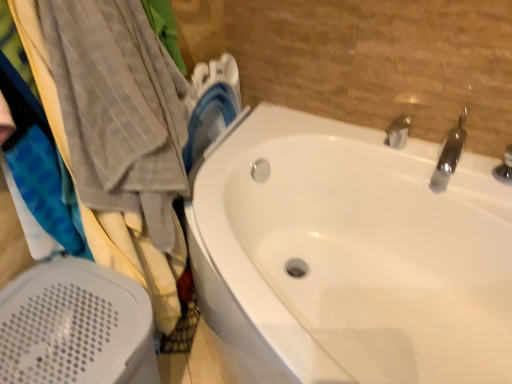
Find the location of a particular element. The width and height of the screenshot is (512, 384). free space above white plastic bath heater at lower left (from a real-world perspective) is located at coordinates (61, 317).